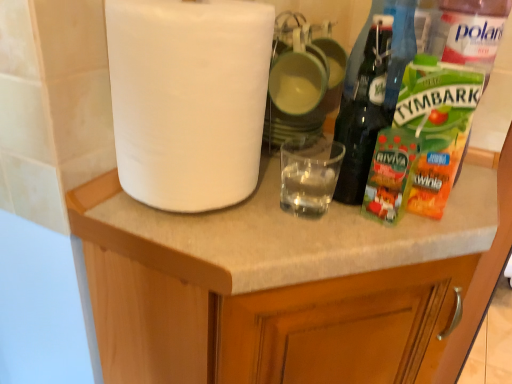
This screenshot has width=512, height=384. Describe the element at coordinates (188, 99) in the screenshot. I see `white matte paper towel at upper left` at that location.

Measure the distance between white matte paper towel at upper left and camera.

They are 42.23 centimeters apart.

The height and width of the screenshot is (384, 512). Identify the location of white matte paper towel at upper left. (188, 99).

Image resolution: width=512 pixels, height=384 pixels. What are the coordinates of `white matte cabinet at upper left` in the screenshot? It's located at (288, 285).

The height and width of the screenshot is (384, 512). Describe the element at coordinates (288, 285) in the screenshot. I see `white matte cabinet at upper left` at that location.

Where is `white matte paper towel at upper left`? The height and width of the screenshot is (384, 512). white matte paper towel at upper left is located at coordinates (188, 99).

Is white matte cabinet at upper left at the right side of white matte paper towel at upper left?

Yes.

In the image, is white matte cabinet at upper left positioned in front of or behind white matte paper towel at upper left?

white matte cabinet at upper left is positioned closer to the viewer than white matte paper towel at upper left.

Which point is more forward, (443,381) or (186,38)?

Positioned in front is point (186,38).

From the image's perspective, is white matte cabinet at upper left on top of white matte paper towel at upper left?

No.

From a real-world perspective, which object stands above the other?

From a 3D spatial view, white matte paper towel at upper left is above.

Consider the image. Is white matte cabinet at upper left wider than white matte paper towel at upper left?

Correct, the width of white matte cabinet at upper left exceeds that of white matte paper towel at upper left.

Considering the sizes of white matte cabinet at upper left and white matte paper towel at upper left in the image, is white matte cabinet at upper left taller or shorter than white matte paper towel at upper left?

In the image, white matte cabinet at upper left appears to be taller than white matte paper towel at upper left.

Between white matte cabinet at upper left and white matte paper towel at upper left, which one has smaller size?

white matte paper towel at upper left.

Would you say white matte cabinet at upper left is outside white matte paper towel at upper left?

Yes, white matte cabinet at upper left is outside of white matte paper towel at upper left.

Is white matte cabinet at upper left touching white matte paper towel at upper left?

white matte cabinet at upper left and white matte paper towel at upper left are not in contact.

Is white matte paper towel at upper left at the back of white matte cabinet at upper left?

No, white matte cabinet at upper left is not facing the opposite direction of white matte paper towel at upper left.

How distant is white matte cabinet at upper left from white matte paper towel at upper left?

They are 20.36 centimeters apart.

Find the location of a particular element. Image resolution: width=512 pixels, height=384 pixels. paper towel behind the white matte cabinet at upper left is located at coordinates (188, 99).

Which is more to the right, white matte paper towel at upper left or white matte cabinet at upper left?

From the viewer's perspective, white matte cabinet at upper left appears more on the right side.

Between white matte paper towel at upper left and white matte cabinet at upper left, which one is positioned behind?

white matte paper towel at upper left is further from the camera.

Which is closer, (181,94) or (116,342)?

Clearly, point (181,94) is closer to the camera than point (116,342).

From the image's perspective, which object appears higher, white matte paper towel at upper left or white matte cabinet at upper left?

white matte paper towel at upper left.

From a real-world perspective, is white matte paper towel at upper left physically above white matte cabinet at upper left?

Yes, from a real-world perspective, white matte paper towel at upper left is over white matte cabinet at upper left

Looking at this image, considering the sizes of objects white matte paper towel at upper left and white matte cabinet at upper left in the image provided, who is thinner, white matte paper towel at upper left or white matte cabinet at upper left?

Thinner between the two is white matte paper towel at upper left.

Considering the sizes of objects white matte paper towel at upper left and white matte cabinet at upper left in the image provided, who is shorter, white matte paper towel at upper left or white matte cabinet at upper left?

With less height is white matte paper towel at upper left.

Is white matte paper towel at upper left bigger than white matte cabinet at upper left?

No.

Would you say white matte paper towel at upper left is outside white matte cabinet at upper left?

Yes, white matte paper towel at upper left is not within white matte cabinet at upper left.

Is white matte paper towel at upper left next to white matte cabinet at upper left?

No, white matte paper towel at upper left is not in contact with white matte cabinet at upper left.

Is white matte paper towel at upper left oriented away from white matte cabinet at upper left?

No, white matte paper towel at upper left is not facing the opposite direction of white matte cabinet at upper left.

Find the location of a particular element. paper towel that appears on the left of white matte cabinet at upper left is located at coordinates (188, 99).

Image resolution: width=512 pixels, height=384 pixels. There is a white matte cabinet at upper left. What are the coordinates of `paper towel above it (from a real-world perspective)` in the screenshot? It's located at (188, 99).

In the image, there is a white matte cabinet at upper left. At what (x,y) coordinates should I click in order to perform the action: click on paper towel above it (from the image's perspective). Please return your answer as a coordinate pair (x, y). Looking at the image, I should click on (188, 99).